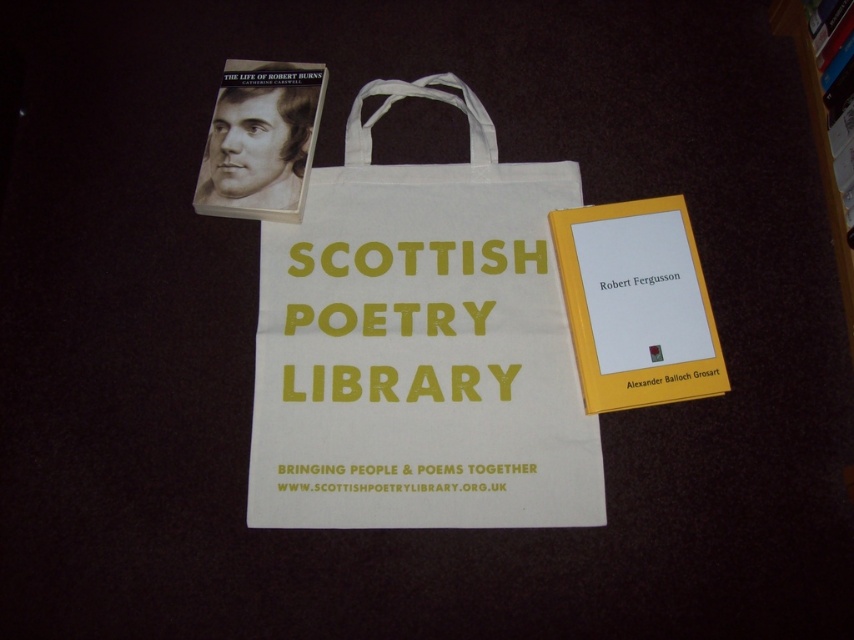
Is white cotton tote bag at center to the right of hardcover book at upper center from the viewer's perspective?

Incorrect, white cotton tote bag at center is not on the right side of hardcover book at upper center.

Locate an element on the screen. white cotton tote bag at center is located at coordinates (420, 344).

Find the location of a particular element. The image size is (854, 640). white cotton tote bag at center is located at coordinates (420, 344).

Can you confirm if yellow printed text at center is shorter than wooden bookshelf at upper right?

Yes.

Who is taller, yellow printed text at center or wooden bookshelf at upper right?

With more height is wooden bookshelf at upper right.

Does point (399, 260) come behind point (841, 244)?

Yes.

At what (x,y) coordinates should I click in order to perform the action: click on yellow printed text at center. Please return your answer as a coordinate pair (x, y). Looking at the image, I should click on (418, 259).

Between point (449, 296) and point (425, 330), which one is positioned in front?

Point (425, 330) is in front.

How distant is white cotton tote bag at center from yellow printed text at center?

1.36 inches

This screenshot has height=640, width=854. Identify the location of white cotton tote bag at center. (420, 344).

I want to click on white cotton tote bag at center, so click(420, 344).